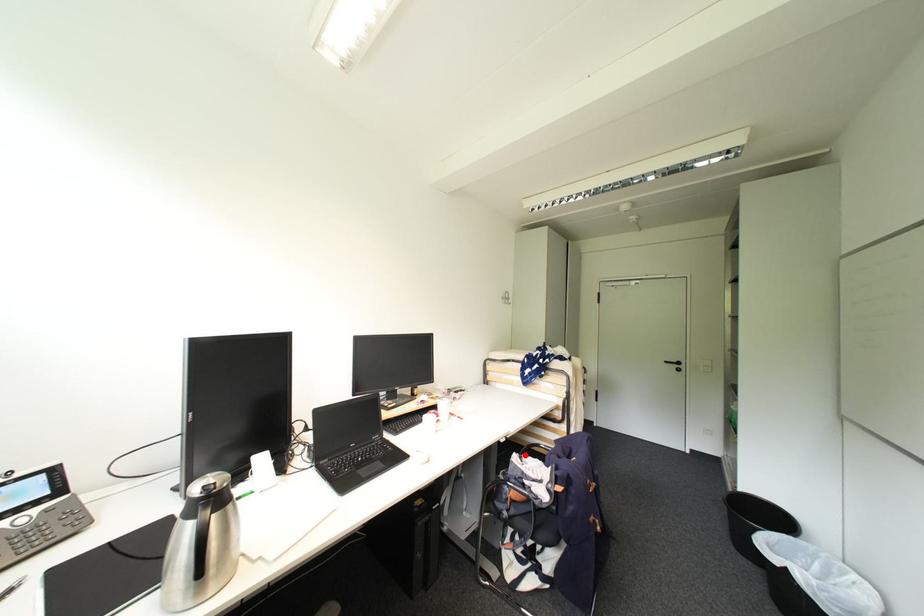
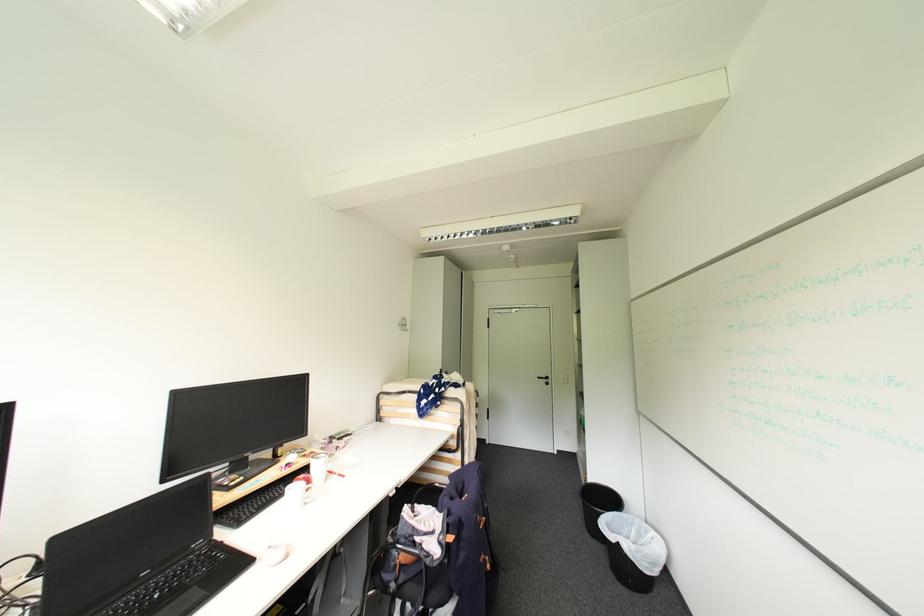
The point at the highlighted location is marked in the first image. Where is the corresponding point in the second image?

(417, 506)